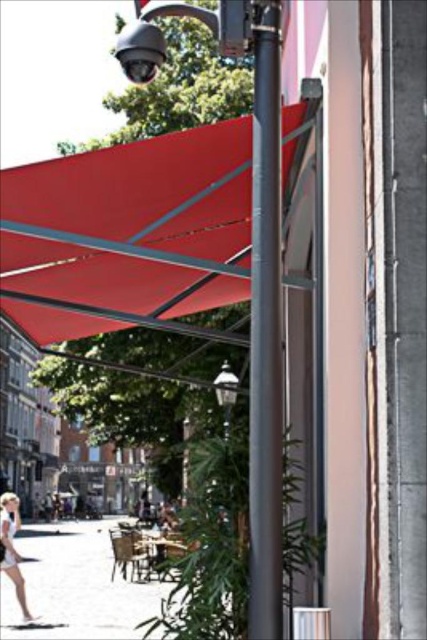
Question: Considering the relative positions of smooth gray pole at center and white cotton dress at lower left in the image provided, where is smooth gray pole at center located with respect to white cotton dress at lower left?

Choices:
 (A) left
 (B) right

Answer: (B)

Question: Which is nearer to the white cotton dress at lower left?

Choices:
 (A) smooth gray pole at center
 (B) matte red awning at center
 (C) smooth concrete pavement at lower left

Answer: (B)

Question: Which of the following is the farthest from the observer?

Choices:
 (A) (269, 333)
 (B) (38, 630)

Answer: (B)

Question: Which object is the closest to the smooth gray pole at center?

Choices:
 (A) white cotton dress at lower left
 (B) matte red awning at center

Answer: (B)

Question: Can you confirm if smooth concrete pavement at lower left is positioned to the right of white cotton dress at lower left?

Choices:
 (A) yes
 (B) no

Answer: (B)

Question: Does matte red awning at center lie in front of smooth gray pole at center?

Choices:
 (A) no
 (B) yes

Answer: (A)